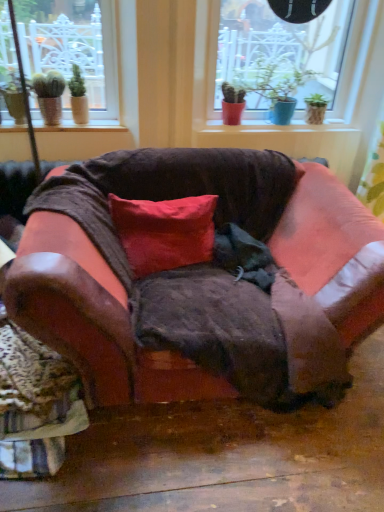
Question: Is smooth ceramic pots at center, marked as the 1th window sill in a right-to-left arrangement, to the left of leather couch at center from the viewer's perspective?

Choices:
 (A) yes
 (B) no

Answer: (B)

Question: Considering the relative positions of smooth ceramic pots at center, which appears as the 2th window sill when viewed from the front, and leather couch at center in the image provided, is smooth ceramic pots at center, which appears as the 2th window sill when viewed from the front, in front of leather couch at center?

Choices:
 (A) no
 (B) yes

Answer: (A)

Question: From a real-world perspective, is smooth ceramic pots at center, marked as the 1th window sill in a right-to-left arrangement, physically above leather couch at center?

Choices:
 (A) no
 (B) yes

Answer: (B)

Question: Does smooth ceramic pots at center, marked as the 1th window sill in a right-to-left arrangement, appear on the right side of leather couch at center?

Choices:
 (A) no
 (B) yes

Answer: (B)

Question: Is smooth ceramic pots at center, marked as the 1th window sill in a right-to-left arrangement, far from leather couch at center?

Choices:
 (A) no
 (B) yes

Answer: (A)

Question: In the image, is smooth wood window sill at upper left, which is the first window sill in front-to-back order, positioned in front of or behind leather couch at center?

Choices:
 (A) front
 (B) behind

Answer: (B)

Question: Is smooth wood window sill at upper left, which is the first window sill in front-to-back order, bigger or smaller than leather couch at center?

Choices:
 (A) small
 (B) big

Answer: (A)

Question: Choose the correct answer: Is smooth wood window sill at upper left, which is the first window sill in front-to-back order, inside leather couch at center or outside it?

Choices:
 (A) inside
 (B) outside

Answer: (B)

Question: From the image's perspective, is smooth wood window sill at upper left, the 2th window sill from the right, positioned above or below leather couch at center?

Choices:
 (A) above
 (B) below

Answer: (A)

Question: Visually, is red cotton pillow at center positioned to the left or to the right of matte brown pot at upper left?

Choices:
 (A) right
 (B) left

Answer: (A)

Question: Considering the positions of point (135, 226) and point (77, 74), is point (135, 226) closer or farther from the camera than point (77, 74)?

Choices:
 (A) farther
 (B) closer

Answer: (B)

Question: From a real-world perspective, is red cotton pillow at center above or below matte brown pot at upper left?

Choices:
 (A) above
 (B) below

Answer: (B)

Question: Looking at the image, does red cotton pillow at center seem bigger or smaller compared to matte brown pot at upper left?

Choices:
 (A) big
 (B) small

Answer: (A)

Question: Would you say matte brown pot at upper left is inside or outside matte red pot at center?

Choices:
 (A) outside
 (B) inside

Answer: (A)

Question: From a real-world perspective, is matte brown pot at upper left physically located above or below matte red pot at center?

Choices:
 (A) above
 (B) below

Answer: (B)